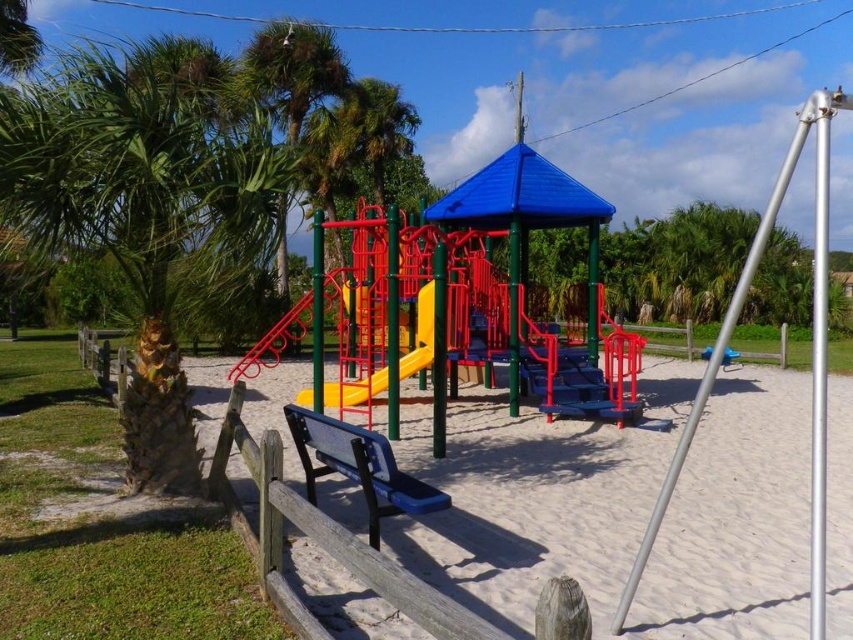
Which of these two, green leafy palm tree at left or silver metallic swing set pole at right, stands shorter?

silver metallic swing set pole at right is shorter.

Is green leafy palm tree at left shorter than silver metallic swing set pole at right?

Incorrect, green leafy palm tree at left's height does not fall short of silver metallic swing set pole at right's.

Where is `green leafy palm tree at left`? Image resolution: width=853 pixels, height=640 pixels. green leafy palm tree at left is located at coordinates (144, 205).

Find the location of a particular element. This screenshot has width=853, height=640. green leafy palm tree at left is located at coordinates (144, 205).

Between white sand at center and yellow plastic slide at center, which one is positioned lower?

white sand at center

Is point (741, 496) closer to camera compared to point (332, 404)?

Yes, it is.

Between point (641, 433) and point (402, 314), which one is positioned in front?

Point (641, 433) is in front.

Locate an element on the screen. The height and width of the screenshot is (640, 853). white sand at center is located at coordinates (624, 508).

Between green leafy palm tree at upper left and yellow plastic slide at center, which one appears on the left side from the viewer's perspective?

Positioned to the left is green leafy palm tree at upper left.

Locate an element on the screen. This screenshot has width=853, height=640. green leafy palm tree at upper left is located at coordinates (293, 72).

Is point (300, 88) positioned behind point (430, 323)?

Yes, point (300, 88) is behind point (430, 323).

Identify the location of green leafy palm tree at upper left. This screenshot has height=640, width=853. (293, 72).